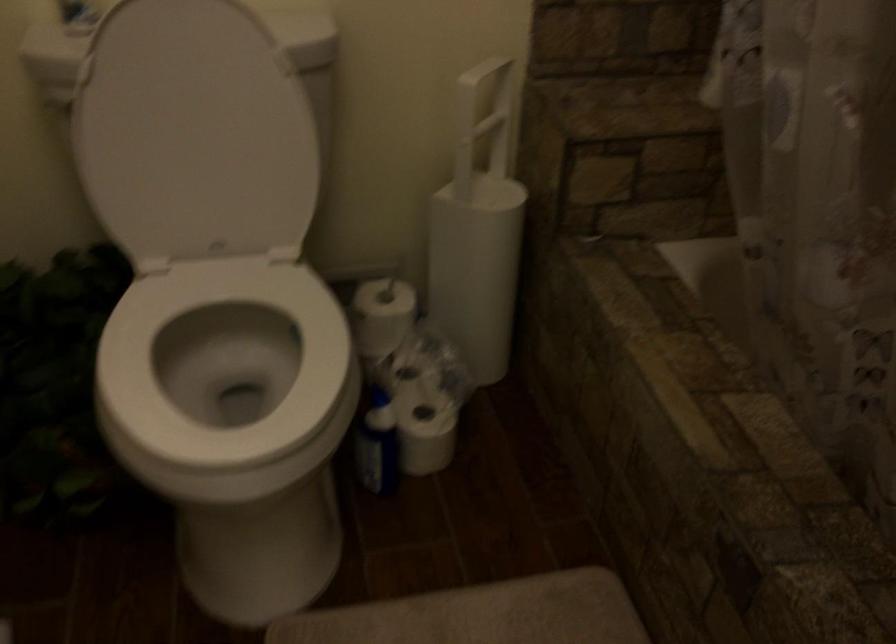
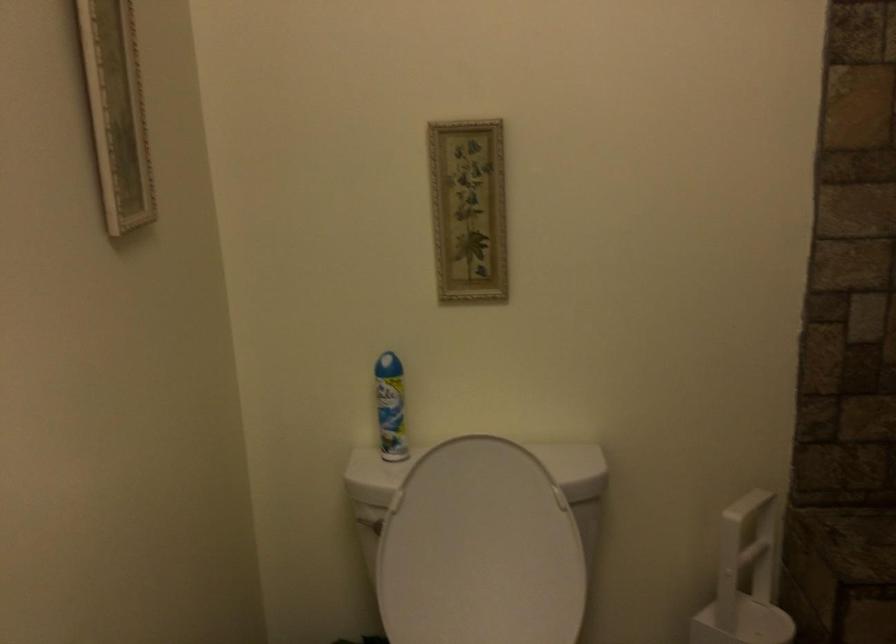
In the second image, find the point that corresponds to point (209, 126) in the first image.

(479, 550)